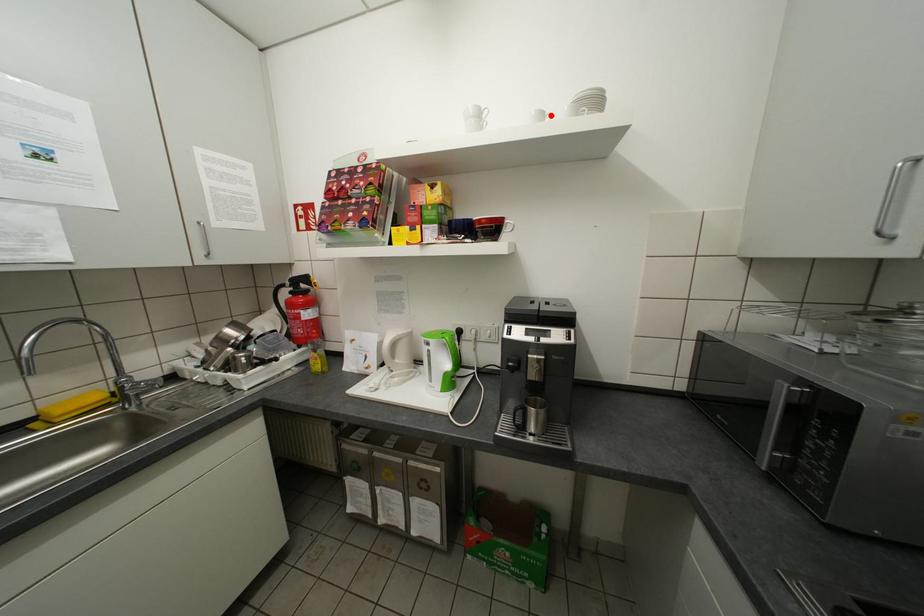
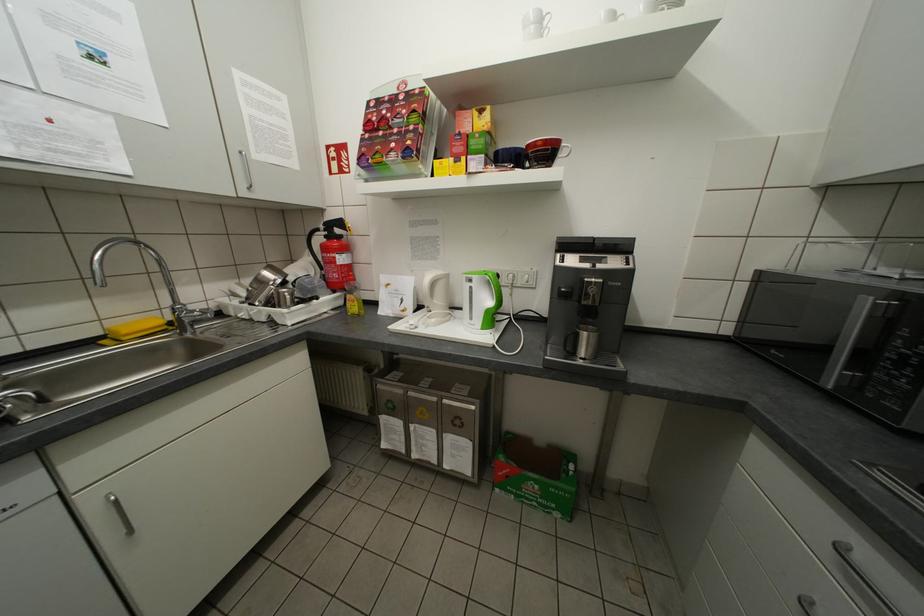
Find the pixel in the second image that matches the highlighted location in the first image.

(623, 17)